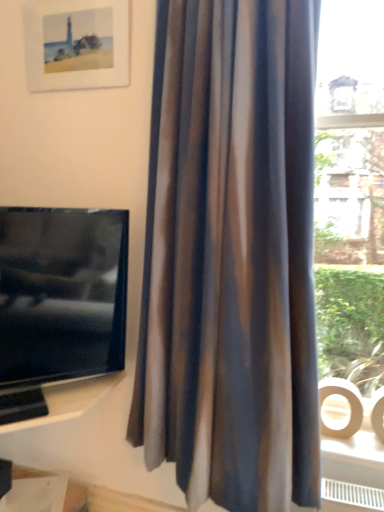
Question: Can you confirm if silky brown curtain at center is shorter than white glossy shelf at lower left?

Choices:
 (A) no
 (B) yes

Answer: (A)

Question: Is silky brown curtain at center bigger than white glossy shelf at lower left?

Choices:
 (A) yes
 (B) no

Answer: (A)

Question: Is silky brown curtain at center positioned in front of white glossy shelf at lower left?

Choices:
 (A) yes
 (B) no

Answer: (A)

Question: Is silky brown curtain at center thinner than white glossy shelf at lower left?

Choices:
 (A) no
 (B) yes

Answer: (A)

Question: Is silky brown curtain at center turned away from white glossy shelf at lower left?

Choices:
 (A) no
 (B) yes

Answer: (A)

Question: Does silky brown curtain at center have a greater height compared to white glossy shelf at lower left?

Choices:
 (A) no
 (B) yes

Answer: (B)

Question: From a real-world perspective, is white glossy shelf at lower left physically below matte paper picture frame at upper left?

Choices:
 (A) no
 (B) yes

Answer: (B)

Question: Can you confirm if white glossy shelf at lower left is bigger than matte paper picture frame at upper left?

Choices:
 (A) yes
 (B) no

Answer: (B)

Question: Is white glossy shelf at lower left taller than matte paper picture frame at upper left?

Choices:
 (A) no
 (B) yes

Answer: (A)

Question: Can you confirm if white glossy shelf at lower left is thinner than matte paper picture frame at upper left?

Choices:
 (A) yes
 (B) no

Answer: (B)

Question: Can you confirm if white glossy shelf at lower left is positioned to the right of matte paper picture frame at upper left?

Choices:
 (A) no
 (B) yes

Answer: (A)

Question: Is there a large distance between white glossy shelf at lower left and matte paper picture frame at upper left?

Choices:
 (A) no
 (B) yes

Answer: (B)

Question: Does matte black tv at left have a greater width compared to silky brown curtain at center?

Choices:
 (A) yes
 (B) no

Answer: (B)